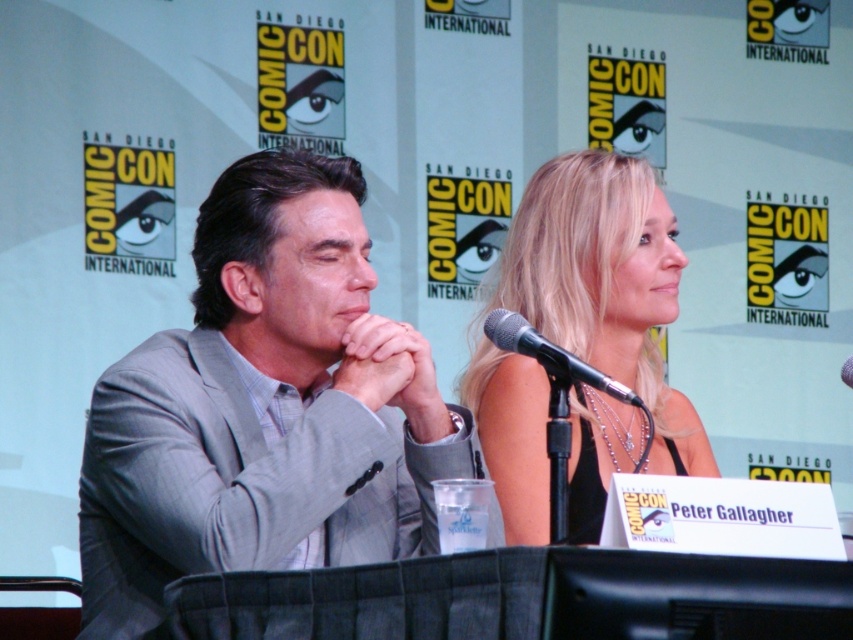
Question: Can you confirm if gray suit at center is bigger than black metallic microphone at center?

Choices:
 (A) yes
 (B) no

Answer: (A)

Question: Among these points, which one is nearest to the camera?

Choices:
 (A) (512, 262)
 (B) (485, 333)

Answer: (B)

Question: Does blonde hair at center appear on the right side of black metallic microphone at center?

Choices:
 (A) no
 (B) yes

Answer: (B)

Question: Which point is farther from the camera taking this photo?

Choices:
 (A) (555, 260)
 (B) (537, 346)

Answer: (A)

Question: Does gray suit at center come behind black metallic microphone at center?

Choices:
 (A) yes
 (B) no

Answer: (A)

Question: Which of the following is the farthest from the observer?

Choices:
 (A) black metallic microphone at center
 (B) gray suit at center
 (C) blonde hair at center

Answer: (C)